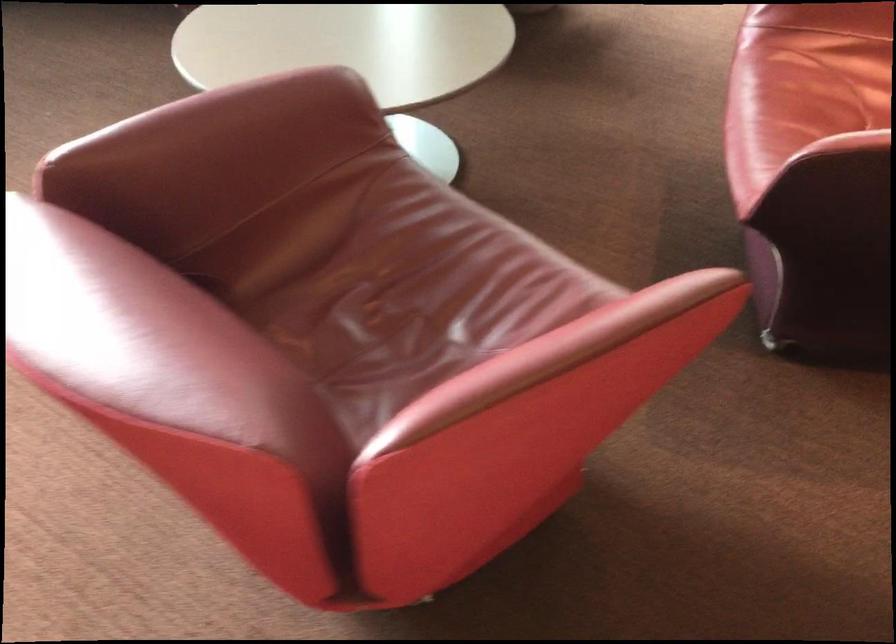
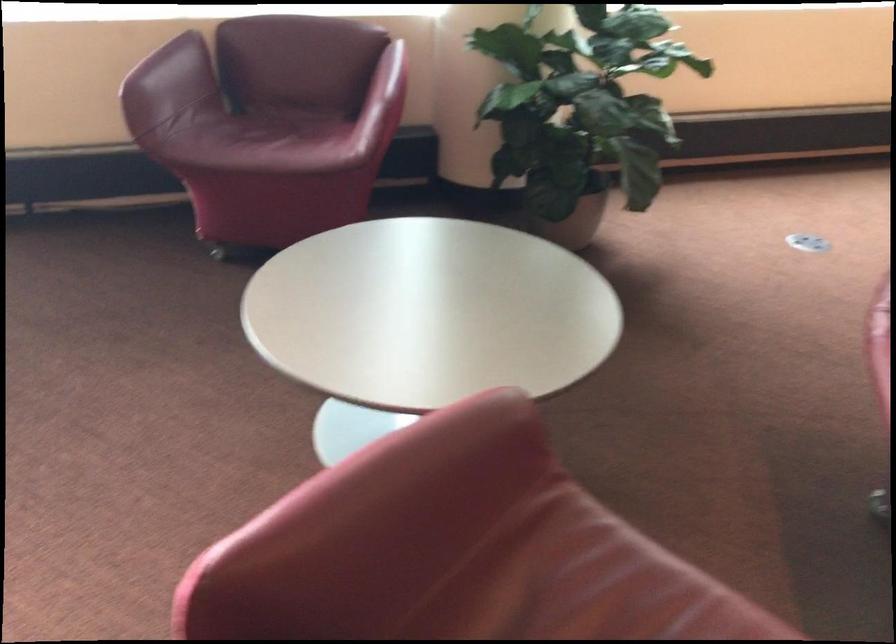
What movement of the cameraman would produce the second image?

The cameraman moved toward left, forward.